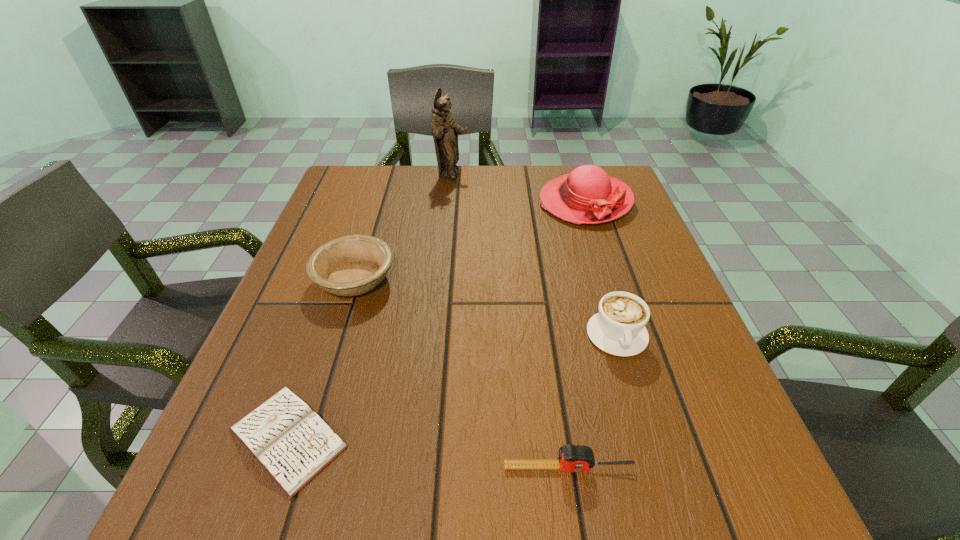
Identify the location of free region located 0.230m at the front of the second tallest object with a bow. (616, 297).

In order to click on free space located to the right of the cappuccino's handle in this screenshot , I will do `click(656, 464)`.

At what (x,y) coordinates should I click in order to perform the action: click on free space located 0.070m on the back of the bowl. Please return your answer as a coordinate pair (x, y). Looking at the image, I should click on coord(369,235).

Locate an element on the screen. Image resolution: width=960 pixels, height=540 pixels. vacant area situated 0.060m on the front of the tape measure is located at coordinates (577, 523).

You are a GUI agent. You are given a task and a screenshot of the screen. Output one action in this format:
    pyautogui.click(x=<x>, y=<y>)
    Task: Click on the vacant region located on the back of the diary
    
    Given the screenshot: What is the action you would take?
    pyautogui.click(x=335, y=299)

Where is `figurine that is at the far edge`? figurine that is at the far edge is located at coordinates (445, 130).

You are a GUI agent. You are given a task and a screenshot of the screen. Output one action in this format:
    pyautogui.click(x=<x>, y=<y>)
    Task: Click on the hat that is at the far edge
    The image size is (960, 540).
    Given the screenshot: What is the action you would take?
    pyautogui.click(x=587, y=195)

Identify the location of tape measure that is positioned at the near edge. (572, 458).

Find the location of a particular element. The width and height of the screenshot is (960, 540). diary situated at the near edge is located at coordinates (293, 444).

This screenshot has width=960, height=540. I want to click on bowl positioned at the left edge, so click(352, 265).